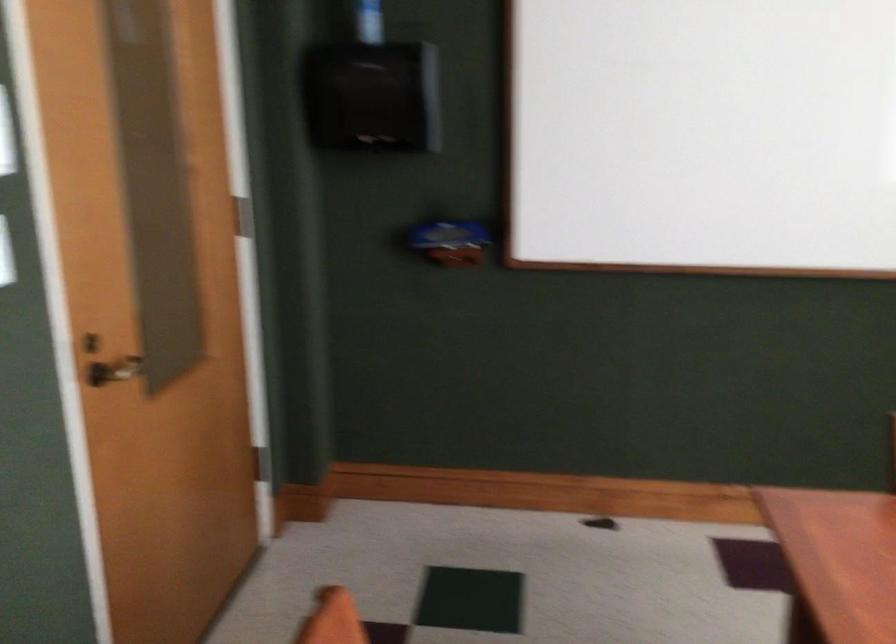
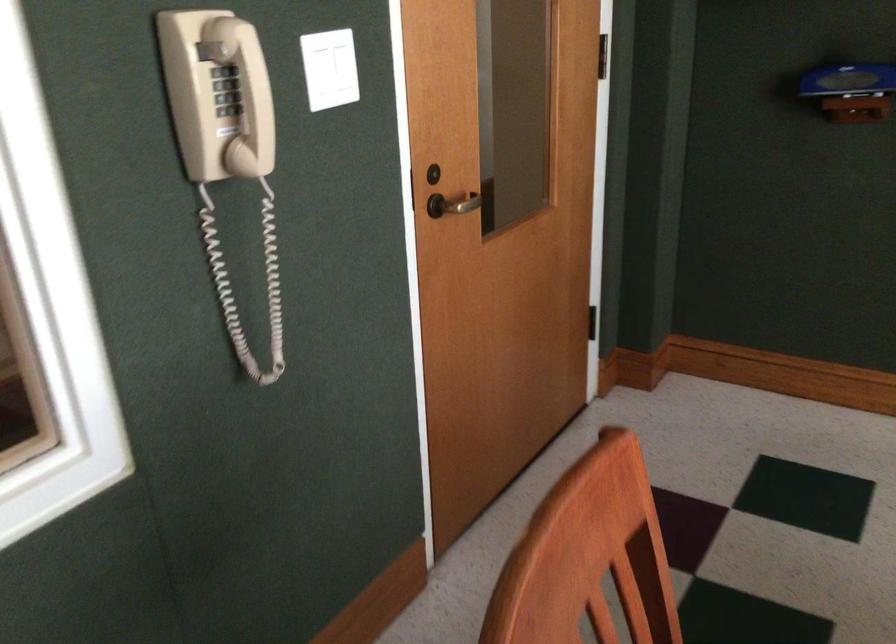
Question: How did the camera likely rotate?

Choices:
 (A) Left
 (B) Right
 (C) Up
 (D) Down

Answer: (A)